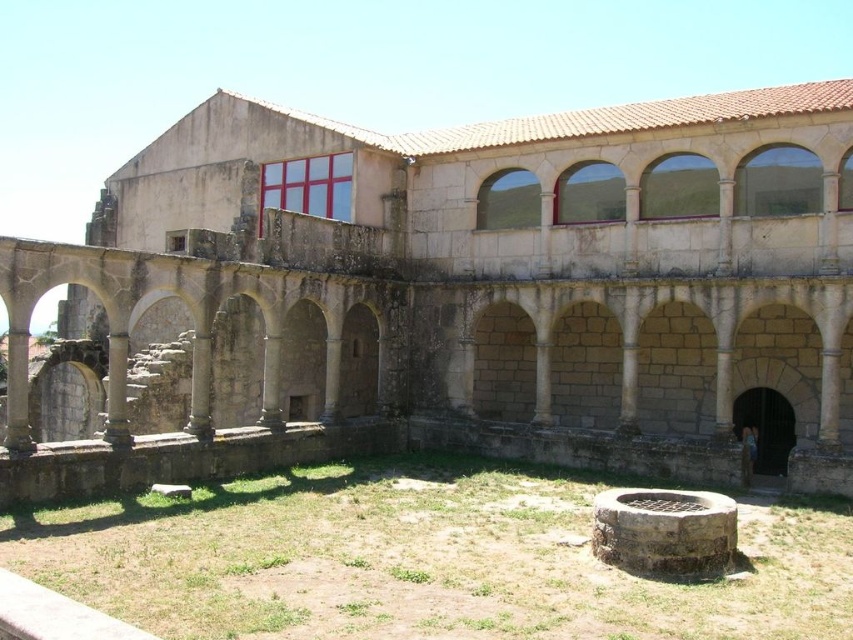
You are standing at point (457, 294) in the courtyard of an ancient stone structure. You want to walk towards the stone arches at center. Which direction should you go?

The stone arches at center are located at point (457, 294), so you are already at the stone arches at center.

You are an architect examining the ancient stone structure. You need to determine the spatial relationship between the stone arches at center and the brown stone well at center. Which object is positioned higher relative to the other?

The stone arches at center are located above the brown stone well at center, so the stone arches at center are positioned higher.